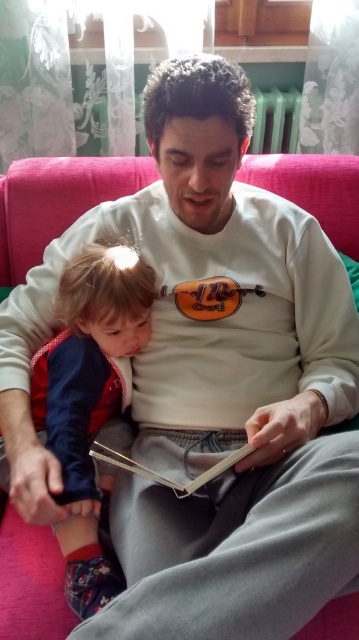
Can you confirm if velvet red jacket at lower left is positioned to the right of hardcover book at center?

No, velvet red jacket at lower left is not to the right of hardcover book at center.

The width and height of the screenshot is (359, 640). In order to click on velvet red jacket at lower left in this screenshot , I will do `click(90, 400)`.